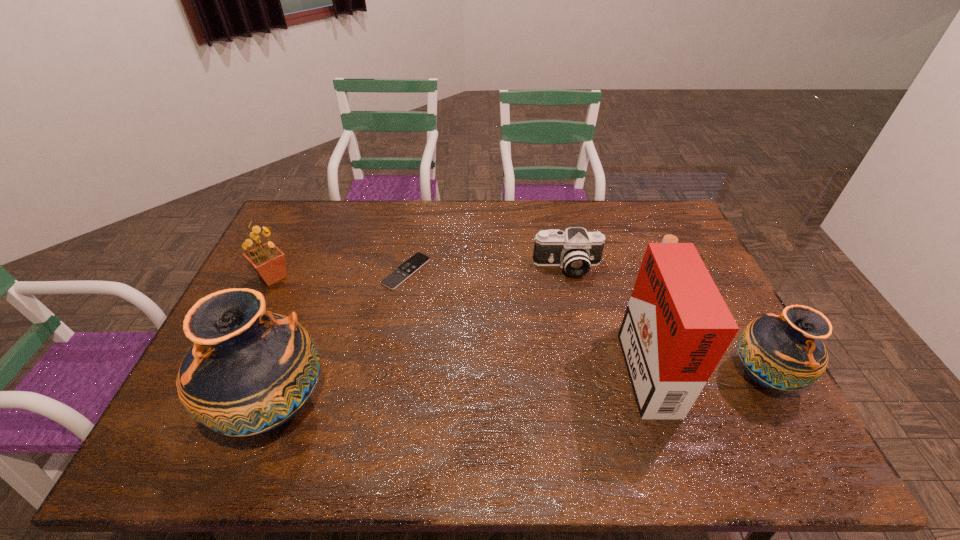
Find the location of a particular element. This screenshot has height=540, width=960. the taller pottery is located at coordinates (249, 371).

Identify the location of the shorter pottery. (785, 352).

Identify the location of the right pottery. (785, 352).

The height and width of the screenshot is (540, 960). I want to click on the shortest object, so click(398, 276).

At what (x,y) coordinates should I click in order to perform the action: click on remote control. Please return your answer as a coordinate pair (x, y). The height and width of the screenshot is (540, 960). Looking at the image, I should click on (398, 276).

Find the location of a particular element. sunflower is located at coordinates (268, 261).

This screenshot has width=960, height=540. I want to click on the fifth tallest object, so click(x=576, y=250).

Locate an element on the screen. The height and width of the screenshot is (540, 960). cigarette case is located at coordinates (676, 328).

At what (x,y) coordinates should I click in order to perform the action: click on free space located on the back of the taller pottery. Please return your answer as a coordinate pair (x, y). Looking at the image, I should click on (300, 338).

Identify the location of vacant space positioned on the back of the right pottery. The height and width of the screenshot is (540, 960). (712, 283).